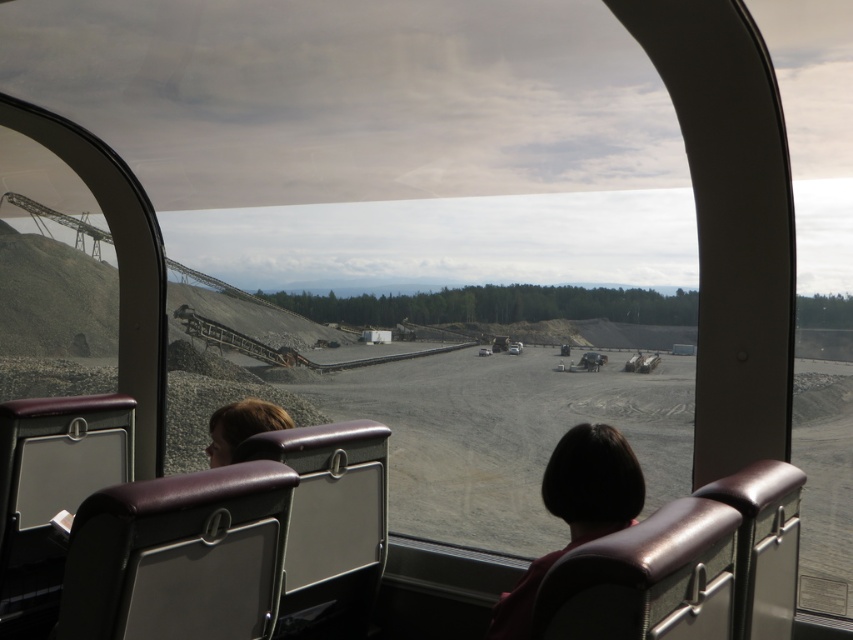
You are a passenger sitting in the train car and want to know if you can reach the dark brown hair at center from the brown hair at left without moving your seat. Can you do it?

The dark brown hair at center and brown hair at left are 3.78 feet apart. Since the distance between them is greater than the typical arm length of a person, you cannot reach the dark brown hair at center from the brown hair at left without moving your seat.

You are a passenger sitting in the train car and notice two people outside the window. One has dark brown hair at center and the other has brown hair at left. Which person appears bigger to you?

The dark brown hair at center appears bigger than the brown hair at left because it has a larger size compared to the brown hair at left.